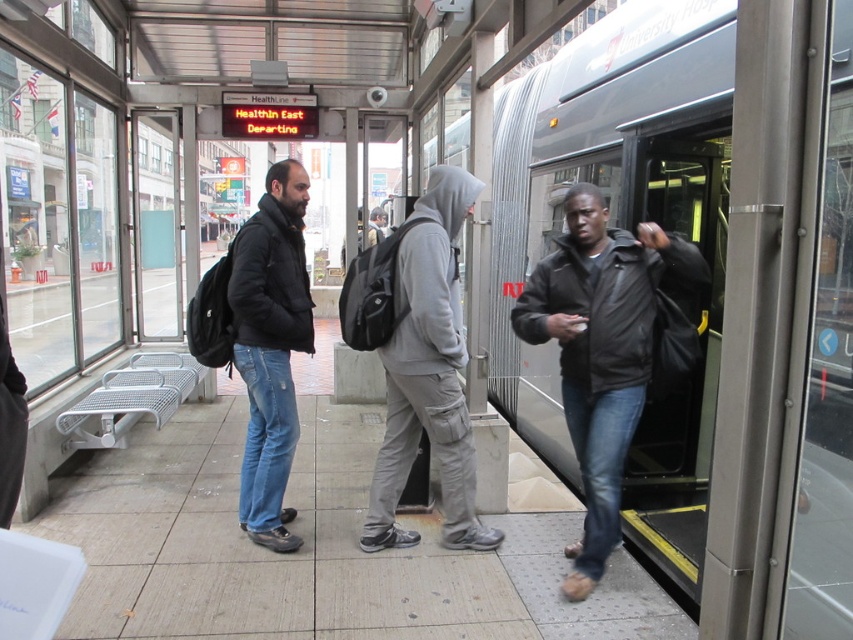
You are a photographer standing on the train station platform. You want to take a photo of the gray hoodie at center and the matte black jacket at center so that both are clearly visible in the frame. Given that your camera has a minimum focus distance of 24 inches, will you be able to capture both subjects in focus without moving closer?

The gray hoodie at center and matte black jacket at center are 26.17 inches apart from each other. Since the distance between them is greater than the camera minimum focus distance of 24 inches, the camera can focus on both subjects as long as they are within the camera focus range. However, the actual ability to capture both in focus also depends on the camera aperture and lens settings. But based on the given information, the distance between them meets the minimum requirement.

You are standing on the train platform and want to ask the person in the gray hoodie at center for directions. Where should you look to find them?

The gray hoodie at center is located at the 2D coordinates point (428, 372).

You are standing at the train station platform and want to determine the relative positions of two points marked on the platform floor. The first point is labeled as point [634,380] and the second is labeled as point [467,461]. Which point is closer to you?

Point [634,380] is closer to the viewer than point [467,461].